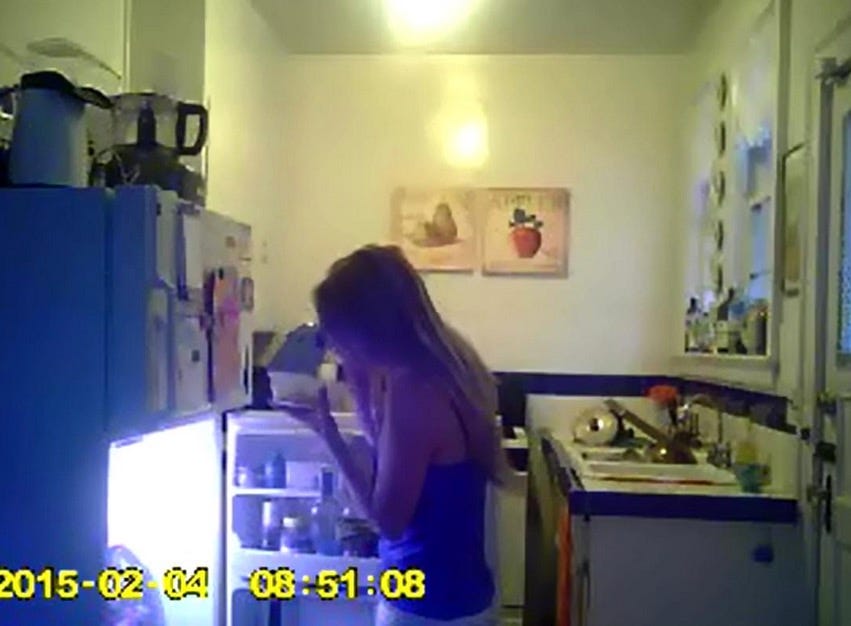
The width and height of the screenshot is (851, 626). I want to click on food processor, so click(146, 119).